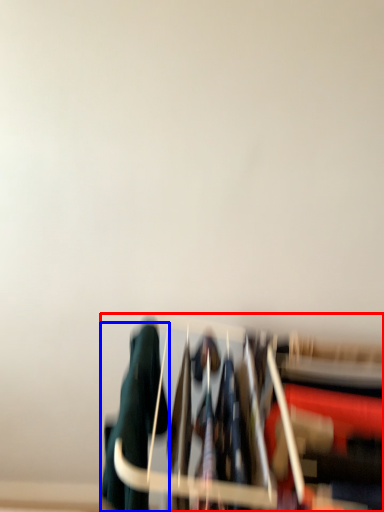
Question: Which object is closer to the camera taking this photo, furniture (highlighted by a red box) or clothing (highlighted by a blue box)?

Choices:
 (A) furniture
 (B) clothing

Answer: (A)